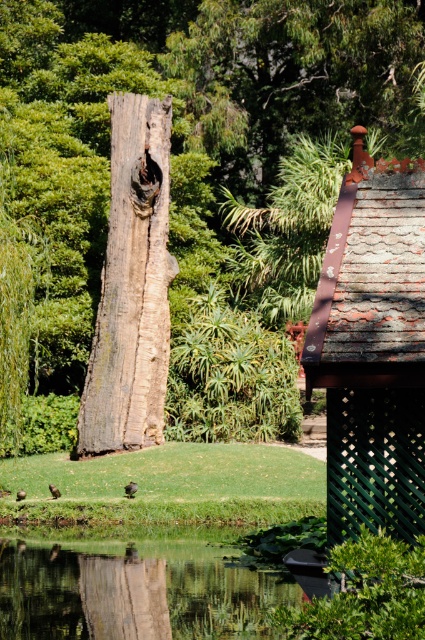
Question: Does weathered wood log at center have a larger size compared to weathered wood tree trunk at center?

Choices:
 (A) yes
 (B) no

Answer: (A)

Question: Which point is closer to the camera taking this photo?

Choices:
 (A) (342, 404)
 (B) (248, 115)

Answer: (A)

Question: Does rusty metal roof at upper right have a greater width compared to weathered wood tree trunk at center?

Choices:
 (A) yes
 (B) no

Answer: (B)

Question: Which point is farther from the camera taking this photo?

Choices:
 (A) (334, 515)
 (B) (166, 272)

Answer: (B)

Question: Does weathered wood log at center have a smaller size compared to rusty metal roof at upper right?

Choices:
 (A) yes
 (B) no

Answer: (B)

Question: Which point appears closest to the camera in this image?

Choices:
 (A) (156, 147)
 (B) (405, 428)
 (C) (189, 24)

Answer: (B)